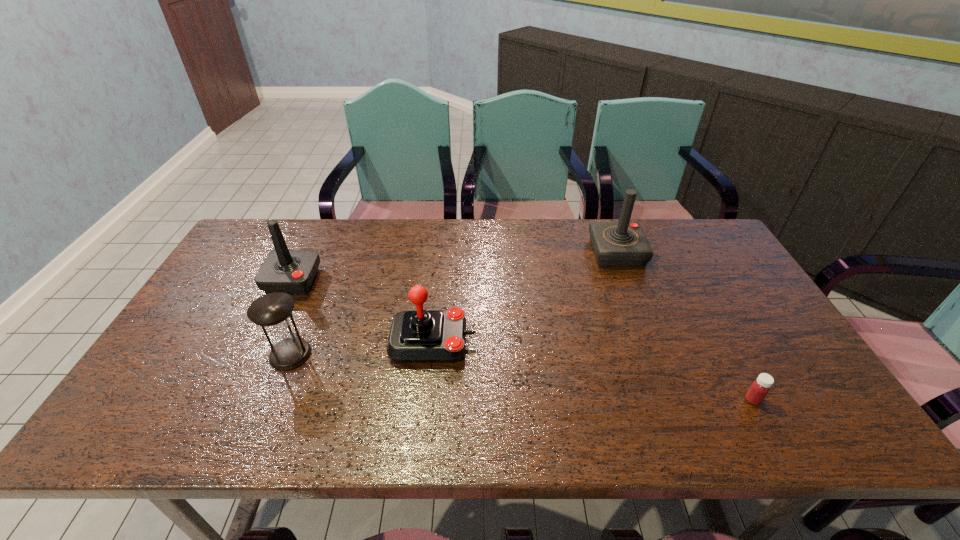
Locate an element on the screen. the fourth object from left to right is located at coordinates (623, 243).

The height and width of the screenshot is (540, 960). Identify the location of the leftmost joystick. 292,271.

The width and height of the screenshot is (960, 540). In order to click on the second joystick from left to right in this screenshot , I will do `click(424, 336)`.

Where is `the nearest joystick`? The image size is (960, 540). the nearest joystick is located at coordinates (424, 336).

Find the location of a particular element. Image resolution: width=960 pixels, height=540 pixels. hourglass is located at coordinates (273, 311).

The width and height of the screenshot is (960, 540). I want to click on the nearest object, so click(x=759, y=389).

Where is `medicine`? medicine is located at coordinates (759, 389).

Where is `free space located 0.350m on the rectangular base of the fourth object from left to right`? The width and height of the screenshot is (960, 540). free space located 0.350m on the rectangular base of the fourth object from left to right is located at coordinates (484, 252).

Identify the location of vacant space situated on the rectangular base of the fourth object from left to right. (551, 252).

Locate an element on the screen. The image size is (960, 540). vacant space located on the rectangular base of the fourth object from left to right is located at coordinates (551, 252).